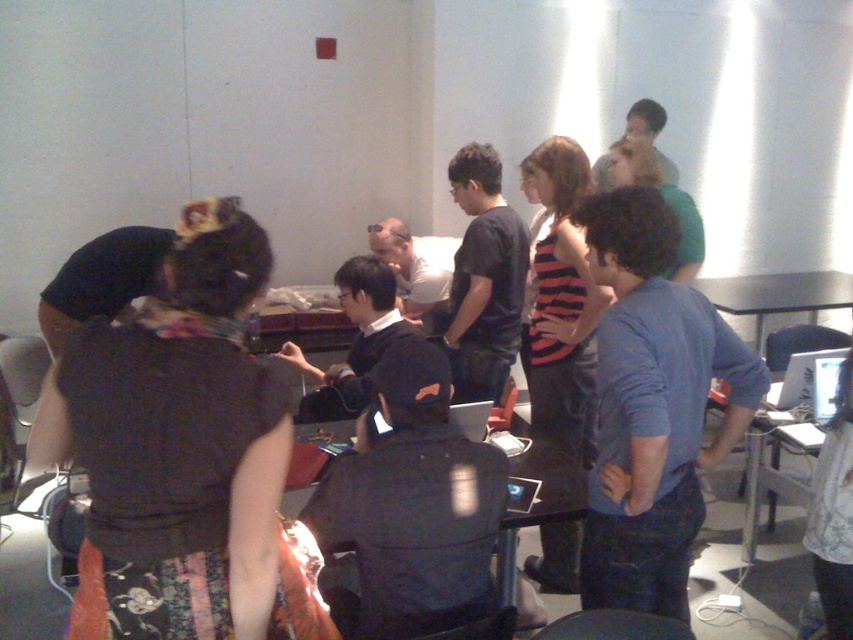
Question: Does blue cotton shirt at center appear on the right side of black fabric stool at lower center?

Choices:
 (A) yes
 (B) no

Answer: (A)

Question: Which object is farther from the camera taking this photo?

Choices:
 (A) silver metallic laptop at center
 (B) blue cotton shirt at center
 (C) striped fabric dress at center

Answer: (C)

Question: Which object is closer to the camera taking this photo?

Choices:
 (A) black matte shirt at center
 (B) silver metallic laptop at center

Answer: (B)

Question: Can you confirm if blue cotton shirt at center is thinner than white lace shirt at center?

Choices:
 (A) no
 (B) yes

Answer: (A)

Question: Is the position of matte black shirt at center less distant than that of metallic silver table at right?

Choices:
 (A) yes
 (B) no

Answer: (A)

Question: Which of the following is the closest to the observer?

Choices:
 (A) (822, 524)
 (B) (531, 620)

Answer: (A)